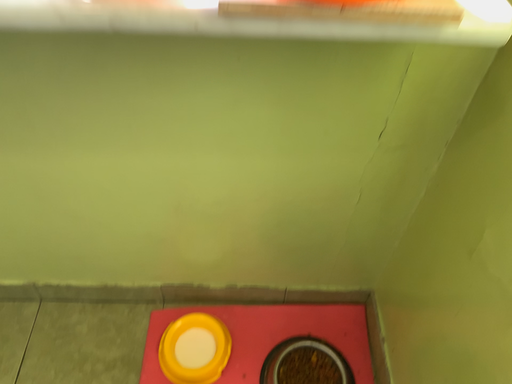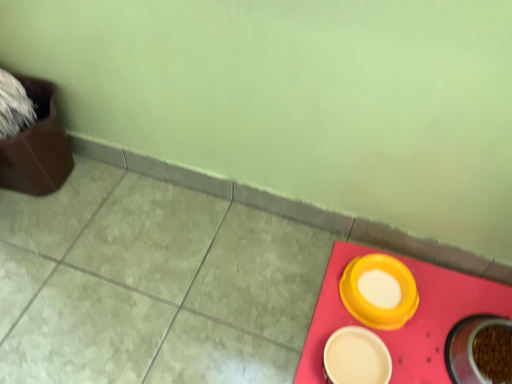
Question: How did the camera likely rotate when shooting the video?

Choices:
 (A) rotated right
 (B) rotated left

Answer: (B)